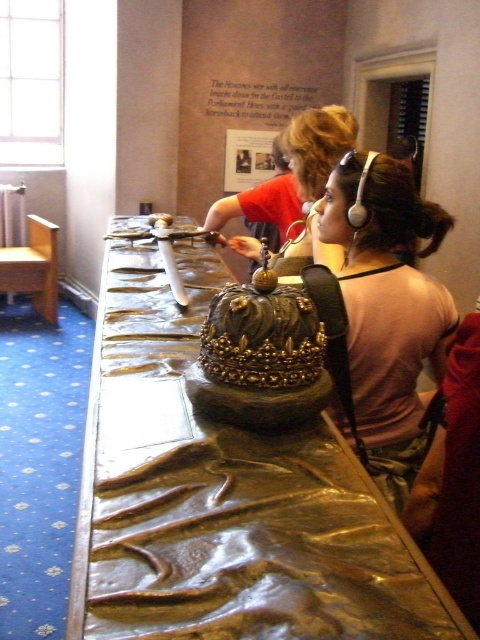
Does gold polished wood table at center appear over pink fabric at center?

Yes.

Between gold polished wood table at center and pink fabric at center, which one appears on the right side from the viewer's perspective?

pink fabric at center is more to the right.

The image size is (480, 640). I want to click on gold polished wood table at center, so coord(223,497).

Image resolution: width=480 pixels, height=640 pixels. I want to click on gold polished wood table at center, so click(223, 497).

Does gold polished wood table at center lie in front of white glossy plate at center?

That is True.

Can you confirm if gold polished wood table at center is shorter than white glossy plate at center?

In fact, gold polished wood table at center may be taller than white glossy plate at center.

Where is `gold polished wood table at center`? gold polished wood table at center is located at coordinates (223, 497).

I want to click on gold polished wood table at center, so click(223, 497).

Does pink fabric at center appear on the right side of white glossy plate at center?

Correct, you'll find pink fabric at center to the right of white glossy plate at center.

Does pink fabric at center have a larger size compared to white glossy plate at center?

Yes, pink fabric at center is bigger than white glossy plate at center.

You are a GUI agent. You are given a task and a screenshot of the screen. Output one action in this format:
    pyautogui.click(x=<x>, y=<y>)
    Task: Click on the pink fabric at center
    
    Given the screenshot: What is the action you would take?
    pyautogui.click(x=386, y=307)